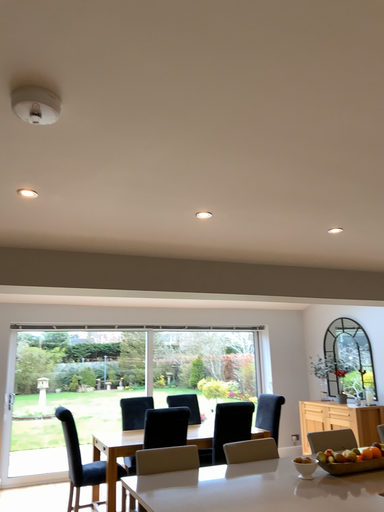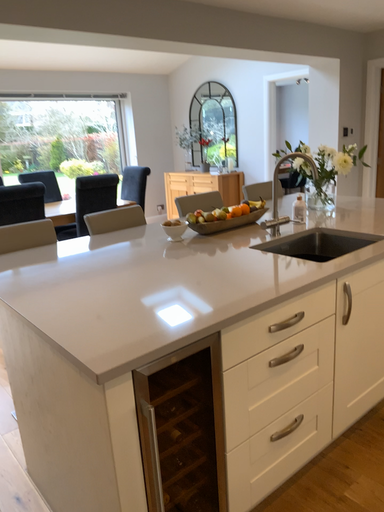
Question: How did the camera likely rotate when shooting the video?

Choices:
 (A) rotated upward
 (B) rotated downward

Answer: (B)